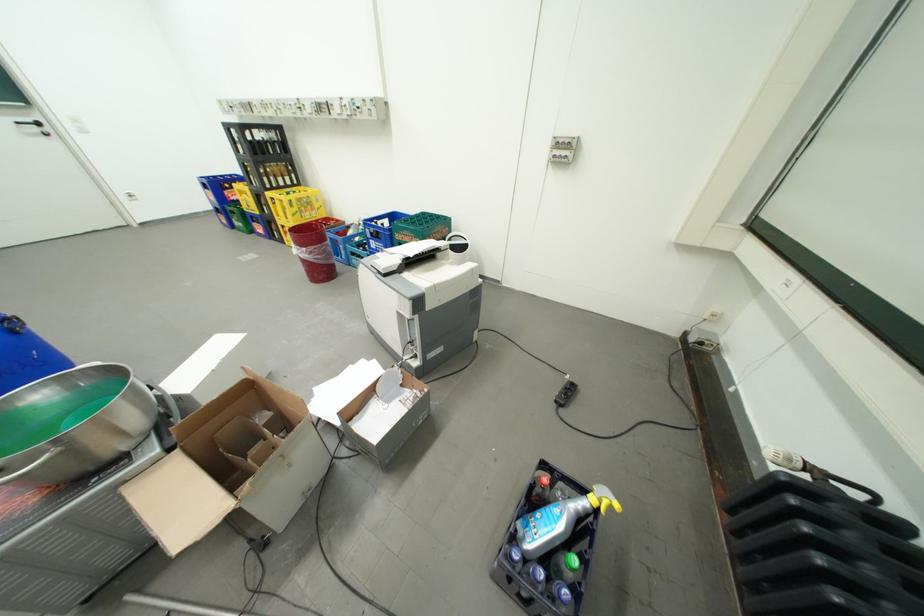
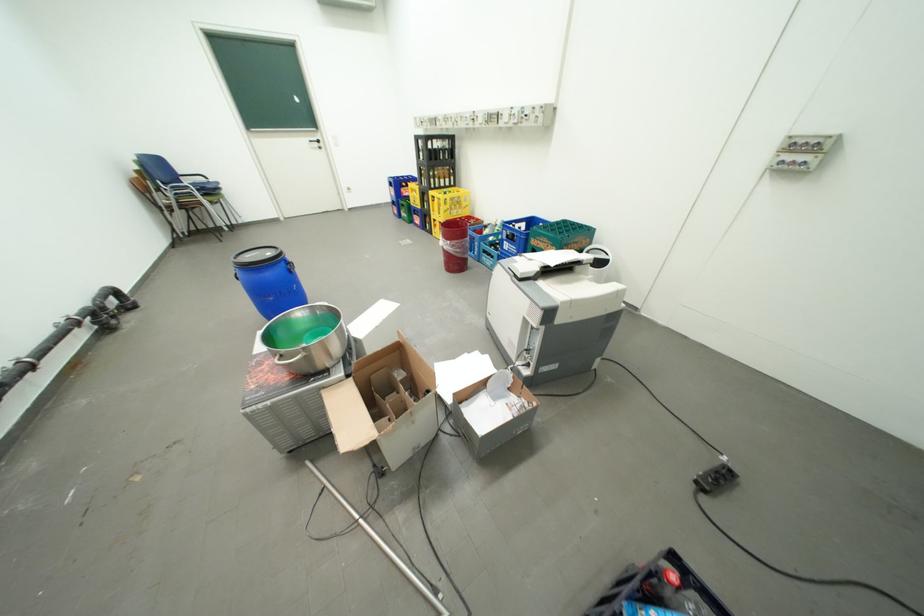
Where in the second image is the point corresponding to (x=249, y=153) from the first image?

(430, 159)